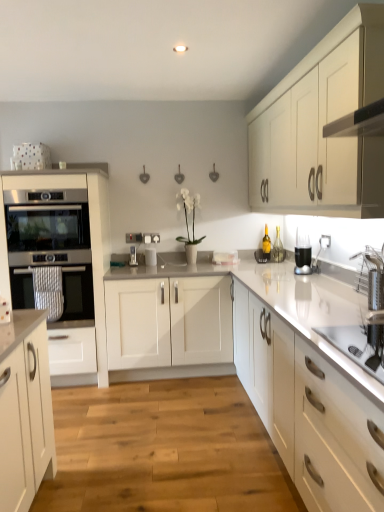
Question: Is black plastic blender at upper right spatially inside metallic silver toaster at center, placed as the 1th appliance when sorted from left to right, or outside of it?

Choices:
 (A) inside
 (B) outside

Answer: (B)

Question: Would you say black plastic blender at upper right is to the left or to the right of metallic silver toaster at center, placed as the 1th appliance when sorted from left to right, in the picture?

Choices:
 (A) right
 (B) left

Answer: (A)

Question: Which of these objects is positioned closest to the stainless steel oven at left, the 2th oven positioned from the top?

Choices:
 (A) satin black oven at left, marked as the 1th oven in a top-to-bottom arrangement
 (B) white matte cabinet at upper right, the 2th cabinetry positioned from the left
 (C) wooden floor at center
 (D) satin white oven at left, the second cabinetry positioned from the right
 (E) white glossy electric kettle at center, the 2th appliance positioned from the left

Answer: (D)

Question: Which object is the farthest from the black plastic blender at upper right?

Choices:
 (A) wooden floor at center
 (B) stainless steel sink at lower right
 (C) satin black oven at left, the 2th oven from the bottom
 (D) satin white oven at left, the second cabinetry positioned from the right
 (E) stainless steel oven at left, the first oven positioned from the bottom

Answer: (C)